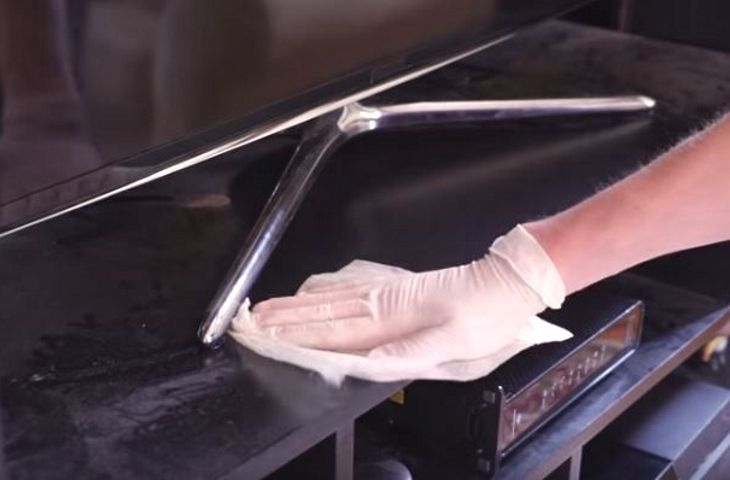
The image size is (730, 480). Identify the location of tv. (239, 41).